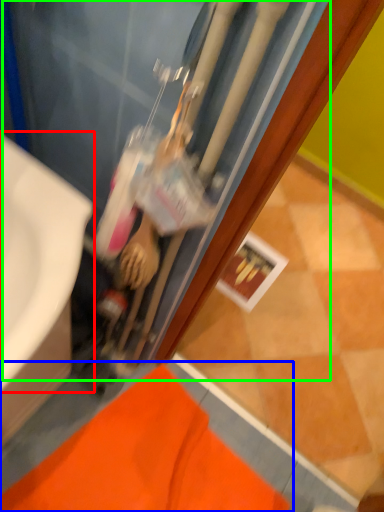
Question: Considering the real-world distances, which object is farthest from sink (highlighted by a red box)? bath mat (highlighted by a blue box) or water heater (highlighted by a green box)?

Choices:
 (A) bath mat
 (B) water heater

Answer: (A)